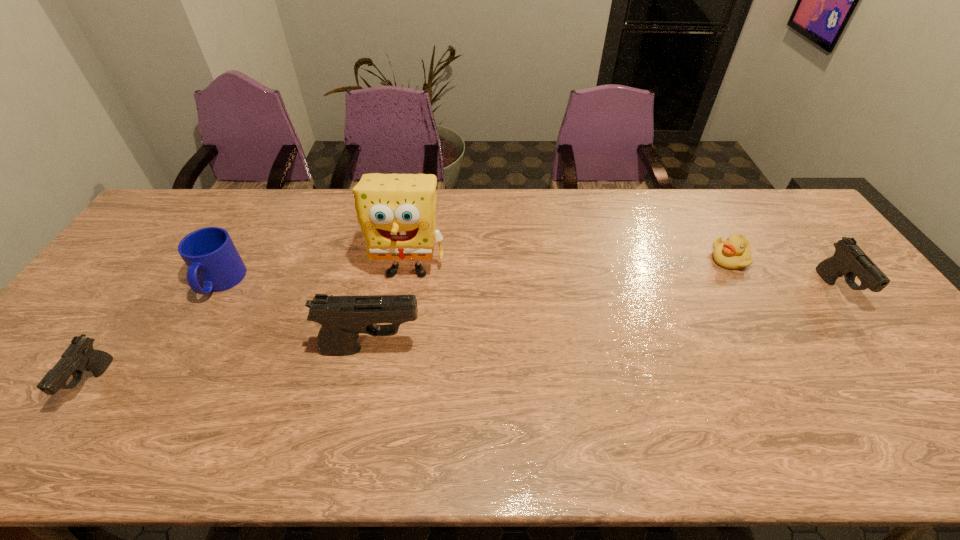
The height and width of the screenshot is (540, 960). I want to click on blank region between the second tallest object and the second shortest pistol, so [x=604, y=319].

I want to click on vacant point located between the second object from left to right and the rightmost pistol, so [528, 286].

In order to click on vacant area that lies between the tallest object and the fifth object from right to left in this screenshot , I will do `click(314, 275)`.

Find the location of a particular element. The image size is (960, 540). unoccupied position between the tallest object and the rightmost pistol is located at coordinates (622, 279).

Identify the location of object that ranks as the closest to the rightmost object. (735, 252).

The image size is (960, 540). Find the location of `the fifth closest object to the tallest object`. the fifth closest object to the tallest object is located at coordinates (849, 260).

The image size is (960, 540). In order to click on pistol that can be found as the closest to the tallest object in this screenshot , I will do `click(343, 318)`.

Identify the location of pistol that is the second closest to the farthest pistol. (79, 356).

The height and width of the screenshot is (540, 960). Find the location of `vacant space that satisfies the following two spatial constraints: 1. at the barrel of the rightmost pistol; 2. at the barrel of the second pistol from right to left`. vacant space that satisfies the following two spatial constraints: 1. at the barrel of the rightmost pistol; 2. at the barrel of the second pistol from right to left is located at coordinates (880, 348).

Identify the location of free location that satisfies the following two spatial constraints: 1. on the face of the sponge; 2. at the barrel of the second pistol from left to right. (395, 348).